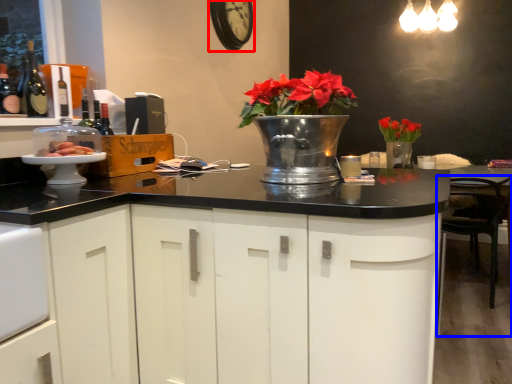
Question: Which object is further to the camera taking this photo, clock (highlighted by a red box) or chair (highlighted by a blue box)?

Choices:
 (A) clock
 (B) chair

Answer: (A)